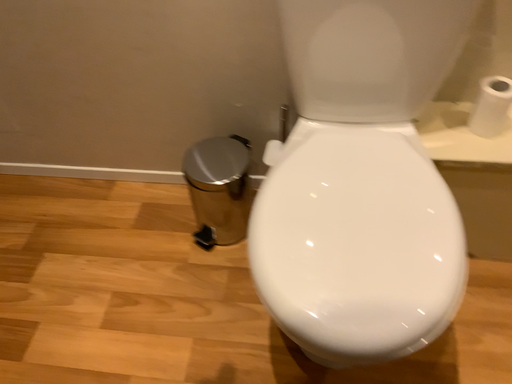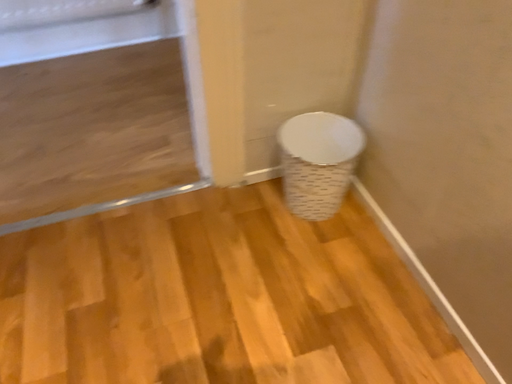
Question: How did the camera likely rotate when shooting the video?

Choices:
 (A) rotated downward
 (B) rotated upward

Answer: (B)